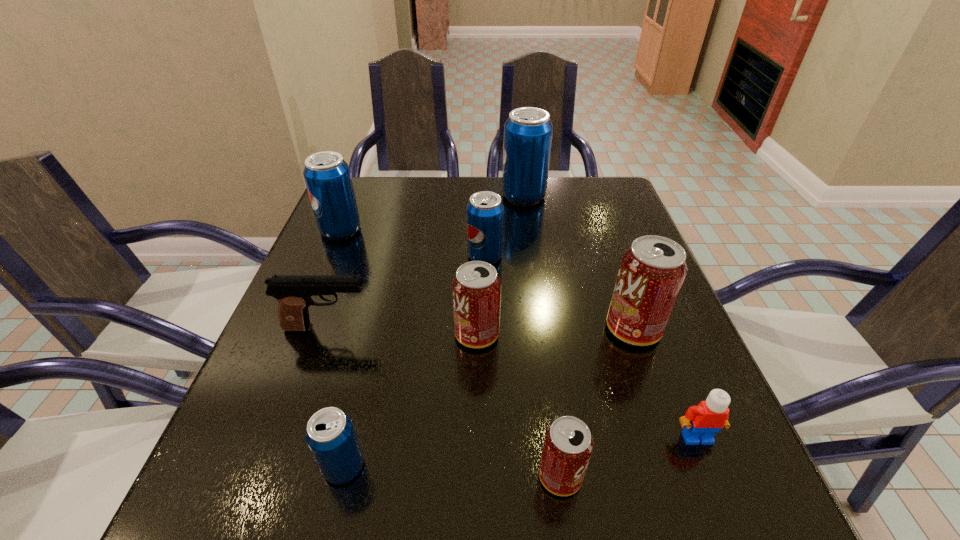
Locate an element on the screen. The width and height of the screenshot is (960, 540). vacant space located 0.080m on the front of the seventh nearest object is located at coordinates point(486,291).

This screenshot has height=540, width=960. Find the location of `free space located at the barrel of the pistol`. free space located at the barrel of the pistol is located at coordinates (515, 328).

Where is `free space located 0.360m on the back of the second blue pop soda from left to right`? free space located 0.360m on the back of the second blue pop soda from left to right is located at coordinates (386, 289).

Where is `vacant space located on the left of the second red soda can from right to left`? This screenshot has height=540, width=960. vacant space located on the left of the second red soda can from right to left is located at coordinates (375, 476).

Locate an element on the screen. This screenshot has width=960, height=540. pop soda at the left edge is located at coordinates (327, 176).

Where is `pistol that is at the left edge`? pistol that is at the left edge is located at coordinates (293, 292).

Identify the location of soda can at the right edge. (652, 271).

The image size is (960, 540). What are the coordinates of `Lego at the right edge` in the screenshot? It's located at (702, 422).

You are a GUI agent. You are given a task and a screenshot of the screen. Output one action in this format:
    pyautogui.click(x=<x>, y=<y>)
    Task: Click on the object that is positioned at the far left corner
    
    Given the screenshot: What is the action you would take?
    pyautogui.click(x=327, y=176)

Where is `free space at the far edge of the desktop`? This screenshot has width=960, height=540. free space at the far edge of the desktop is located at coordinates (445, 179).